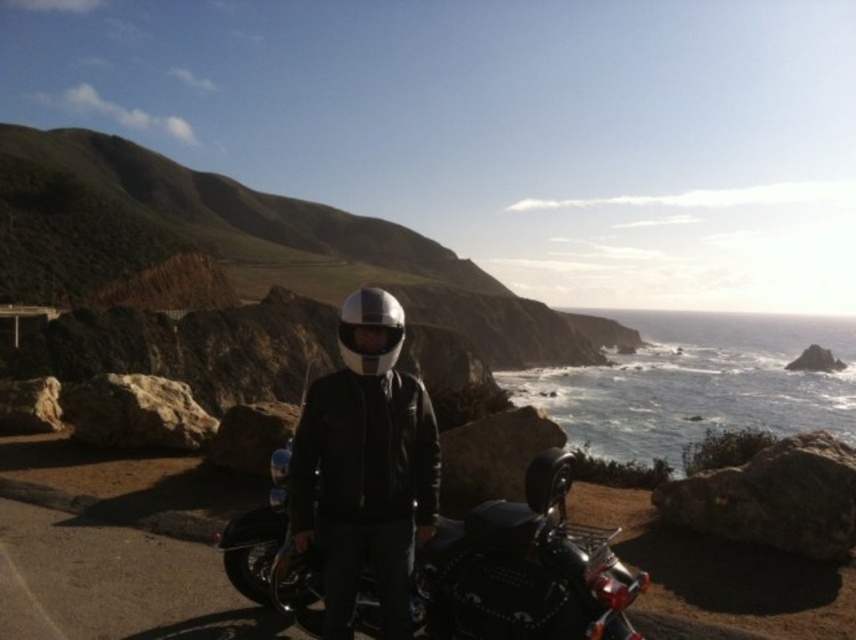
You are a photographer trying to capture the motorcycle and rider in the scene. You notice two helmets at the center of the image. Which helmet is placed lower between the shiny black helmet at center and the glossy metallic helmet at center?

The shiny black helmet at center is positioned under the glossy metallic helmet at center, so it is placed lower.

You are a photographer trying to capture the shiny chrome motorcycle at center and the glossy metallic helmet at center in a single shot. Since you want both objects to be clearly visible, you need to adjust your camera focus. Which object should you focus on first to ensure it appears sharp in the photo?

The shiny chrome motorcycle at center is shorter than the glossy metallic helmet at center. Therefore, you should focus on the glossy metallic helmet at center first because it is taller and might require more precise focus to capture its details clearly.